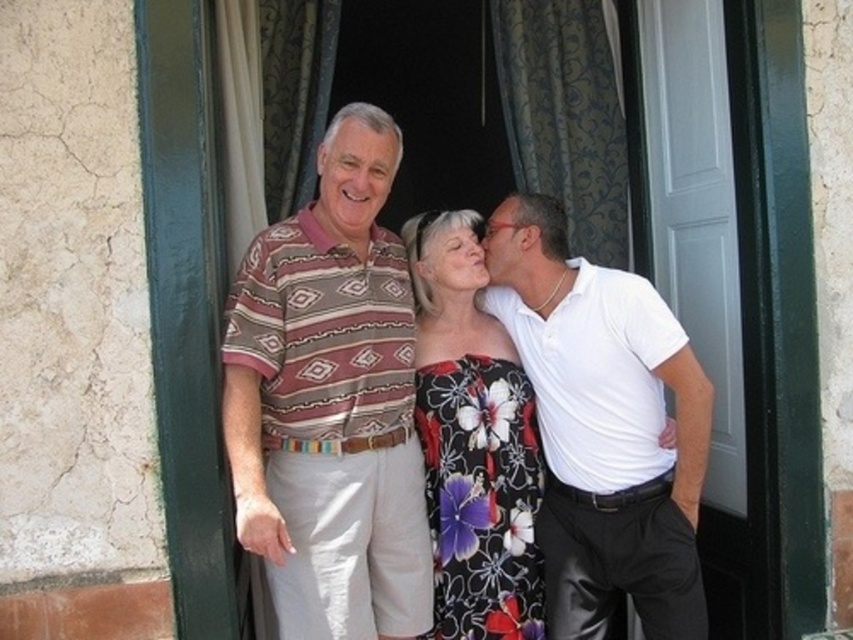
You are organizing a charity event and need to determine if the brown striped polo shirt at center can fit into a storage box designed for the white glossy shirt at right. Based on their sizes, will it fit?

The brown striped polo shirt at center is larger in size than the white glossy shirt at right, so it may not fit into the storage box designed for the white glossy shirt at right.

You are taking a photo of the group and want to ensure both the brown striped polo shirt at center and the white glossy shirt at right are in focus. Which one should you adjust your camera focus to prioritize first?

You should prioritize focusing on the brown striped polo shirt at center first because it is closer to the viewer than the white glossy shirt at right. This way, you can ensure both are in focus by adjusting the depth of field or focusing on a midpoint between them.

You are organizing a photo shoot and need to place two outfits in a showcase. The showcase has a limited space. The two outfits are the brown striped polo shirt at center and the floral dress at center. Based on their sizes, which outfit should you place first to ensure both fit properly?

The brown striped polo shirt at center is larger in size than the floral dress at center, so you should place the brown striped polo shirt at center first to accommodate its larger size, ensuring both outfits fit in the showcase.